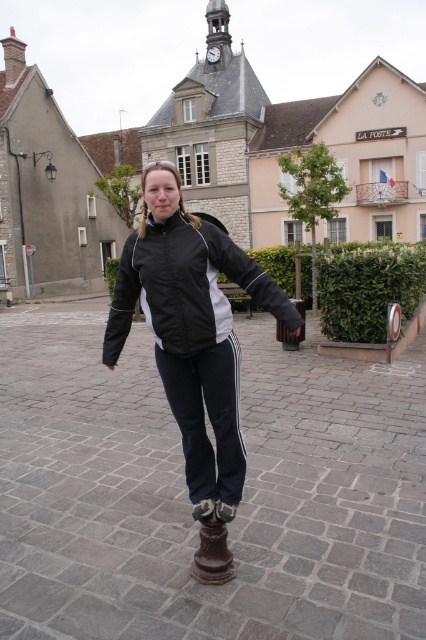
You are standing in the town square and see the black matte jacket at center. If you want to reach it without moving your feet, can you just stretch your hand out?

The black matte jacket at center is 9.15 feet away from the viewer. Since the average human arm length is about 2.5 feet, you cannot reach it without moving closer.